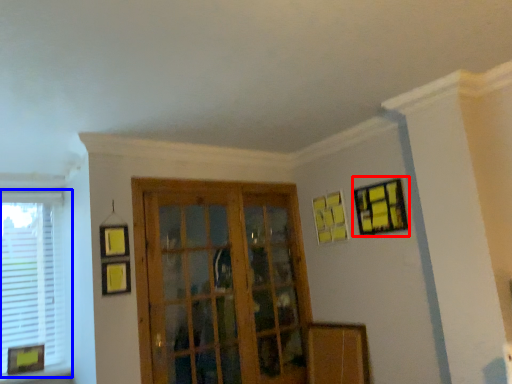
Question: Which object appears closest to the camera in this image, picture frame (highlighted by a red box) or window (highlighted by a blue box)?

Choices:
 (A) picture frame
 (B) window

Answer: (A)